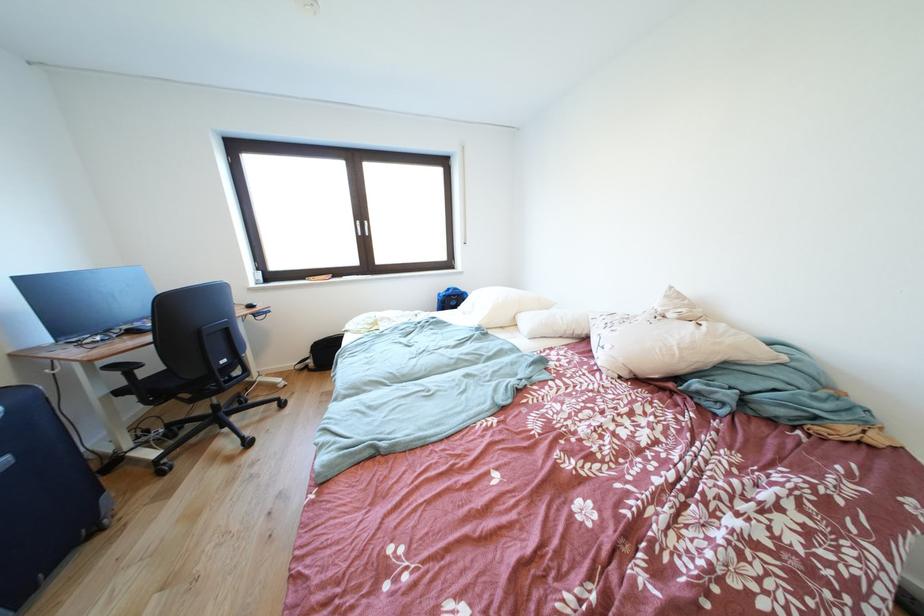
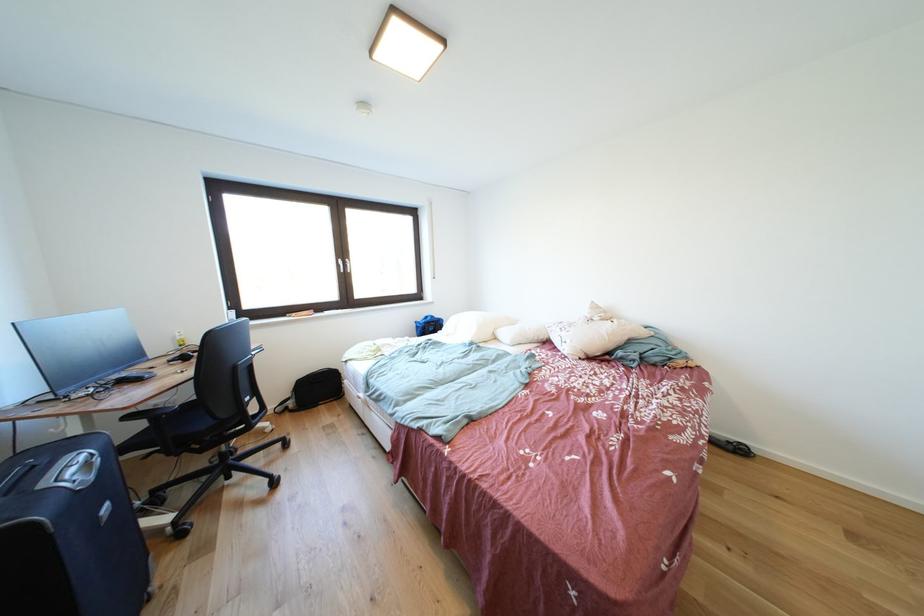
In the second image, find the point that corresponds to (367,228) in the first image.

(348, 265)